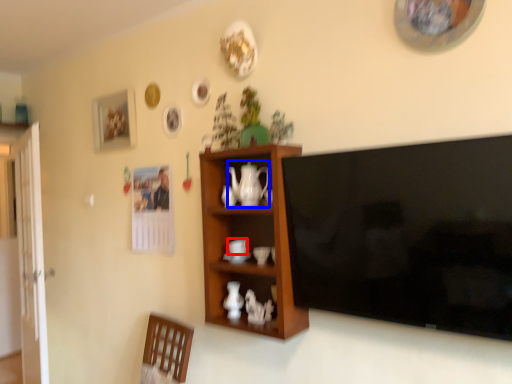
Question: Which point is closer to the camera, coffee cup (highlighted by a red box) or teapot (highlighted by a blue box)?

Choices:
 (A) coffee cup
 (B) teapot

Answer: (B)